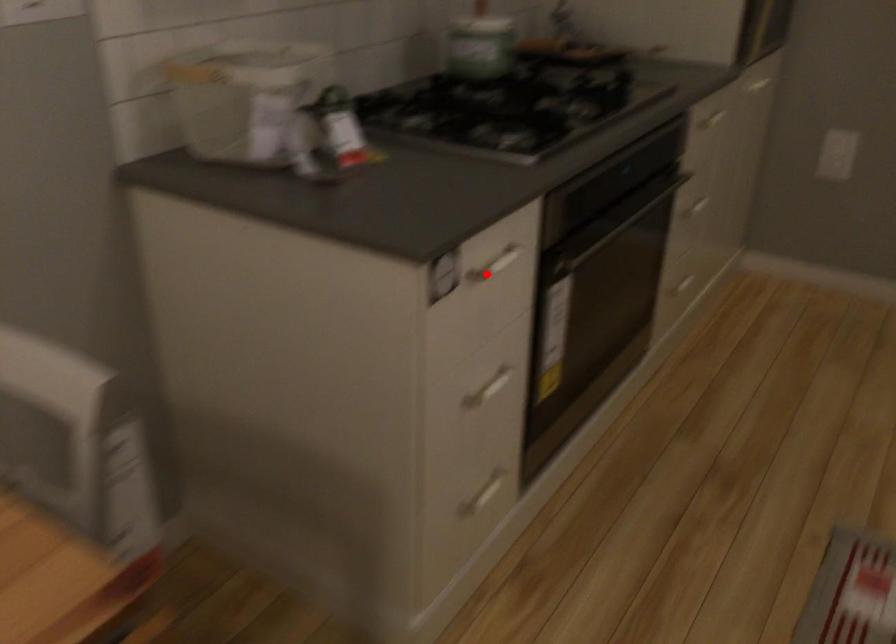
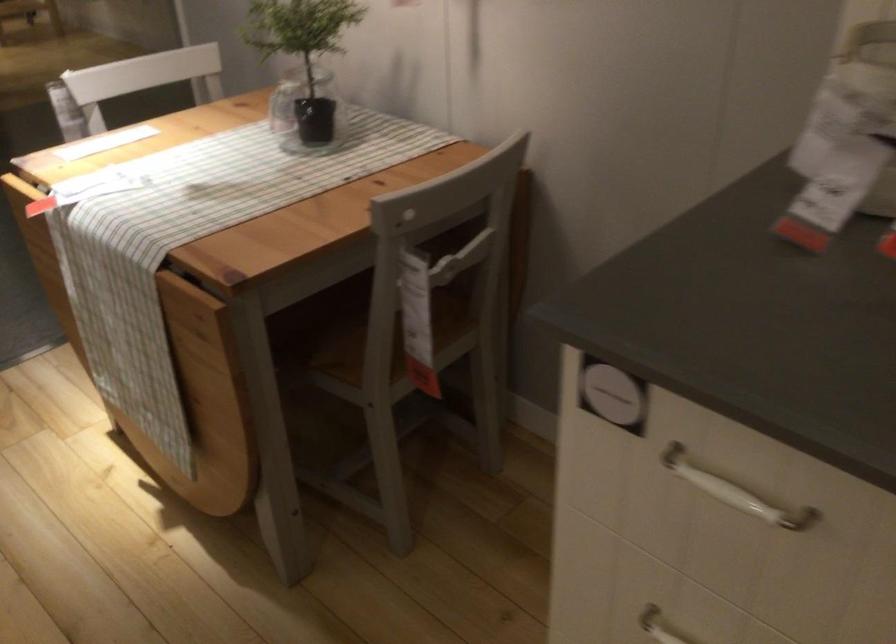
Where in the second image is the point corresponding to the highlighted location from the first image?

(734, 491)